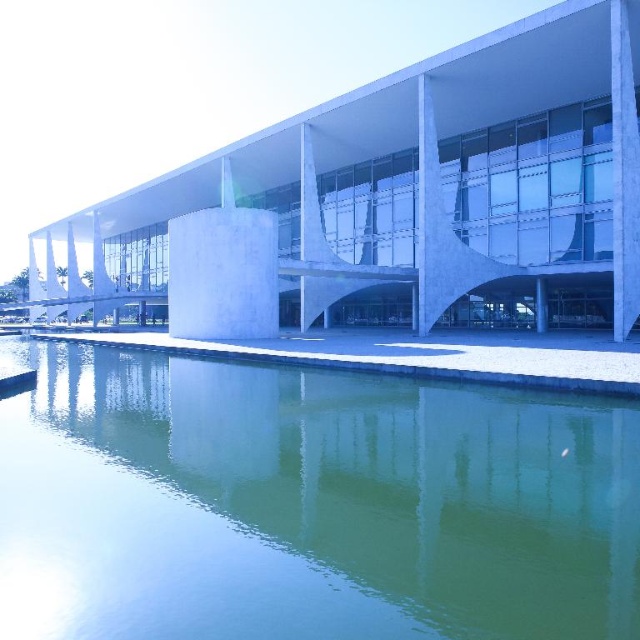
You are standing in front of the modern building and notice two points marked in the image. The first point is at coordinates point (317,422) and the second is at point (477,193). Which of these points appears closer to you?

Point (317,422) is closer to the camera than point (477,193), so the first point appears closer to you.

You are standing in front of the modern architectural structure and want to take a photo of the green reflective water at center. Where exactly should you position yourself to capture its reflection?

You should position yourself directly in front of the green reflective water at center at point (308, 504) to capture its reflection.

From the picture: You are a drone operator tasked with capturing aerial footage of the white concrete building at center. You need to fly your drone over the green reflective water at center to reach the building. What is the minimum distance your drone must travel to reach the building from the water?

The minimum distance the drone must travel is 27.77 meters, as the green reflective water at center and white concrete building at center are 27.77 meters apart from each other.